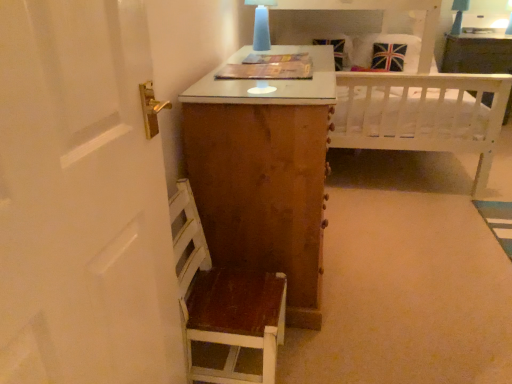
Question: From a real-world perspective, does union jack fabric pillow at upper right sit lower than white wood vanity at upper right?

Choices:
 (A) yes
 (B) no

Answer: (B)

Question: Is the depth of union jack fabric pillow at upper right greater than that of white wood vanity at upper right?

Choices:
 (A) no
 (B) yes

Answer: (A)

Question: Can white wood vanity at upper right be found inside union jack fabric pillow at upper right?

Choices:
 (A) yes
 (B) no

Answer: (B)

Question: Could you tell me if union jack fabric pillow at upper right is facing white wood vanity at upper right?

Choices:
 (A) yes
 (B) no

Answer: (B)

Question: Is union jack fabric pillow at upper right not near white wood vanity at upper right?

Choices:
 (A) yes
 (B) no

Answer: (B)

Question: Does union jack fabric pillow at upper right have a lesser height compared to white wood vanity at upper right?

Choices:
 (A) no
 (B) yes

Answer: (B)

Question: Is white wood vanity at upper right next to union jack fabric pillow at upper right?

Choices:
 (A) yes
 (B) no

Answer: (B)

Question: Would you say white wood vanity at upper right is a long distance from union jack fabric pillow at upper right?

Choices:
 (A) yes
 (B) no

Answer: (B)

Question: Considering the relative positions of white wood vanity at upper right and union jack fabric pillow at upper right in the image provided, is white wood vanity at upper right to the left of union jack fabric pillow at upper right from the viewer's perspective?

Choices:
 (A) yes
 (B) no

Answer: (B)

Question: Is white wood vanity at upper right at the right side of union jack fabric pillow at upper right?

Choices:
 (A) no
 (B) yes

Answer: (B)

Question: Considering the relative sizes of white wood vanity at upper right and union jack fabric pillow at upper right in the image provided, is white wood vanity at upper right smaller than union jack fabric pillow at upper right?

Choices:
 (A) yes
 (B) no

Answer: (B)

Question: Is white wood vanity at upper right oriented away from union jack fabric pillow at upper right?

Choices:
 (A) no
 (B) yes

Answer: (A)

Question: Considering the relative sizes of matte blue glass at upper center and wooden chair at lower left in the image provided, is matte blue glass at upper center smaller than wooden chair at lower left?

Choices:
 (A) no
 (B) yes

Answer: (B)